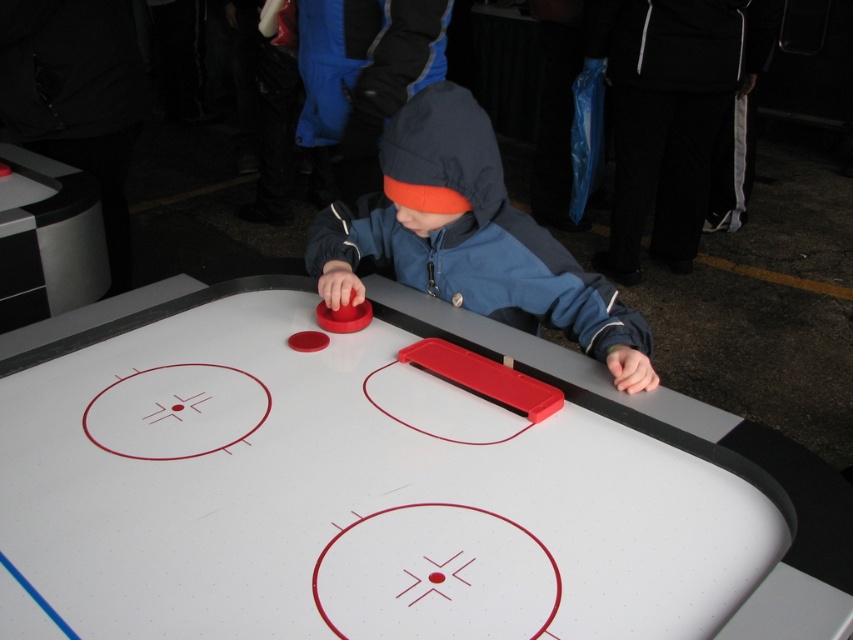
You are a game assistant trying to help the child win the air hockey game. The red puck is at point (184, 458) and the red paddle is at point (584, 323). To hit the puck towards the opponent, you need to move the paddle to the puck first. Is the puck in front of or behind the paddle?

The puck at point (184, 458) is in front of the paddle at point (584, 323), so you should move the paddle forward to reach it.

You are standing in the middle of the image and want to reach the white glossy air hockey table at center and the matte blue jacket at center. Which one is closer to your current position?

The white glossy air hockey table at center is closer to your current position because it is to the left of the matte blue jacket at center, meaning it is nearer to the center where you are standing.